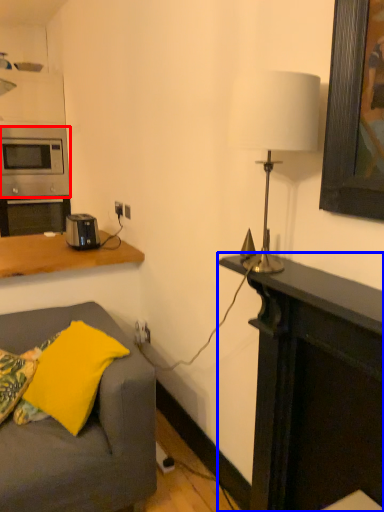
Question: Which point is further to the camera, microwave oven (highlighted by a red box) or desk (highlighted by a blue box)?

Choices:
 (A) microwave oven
 (B) desk

Answer: (A)